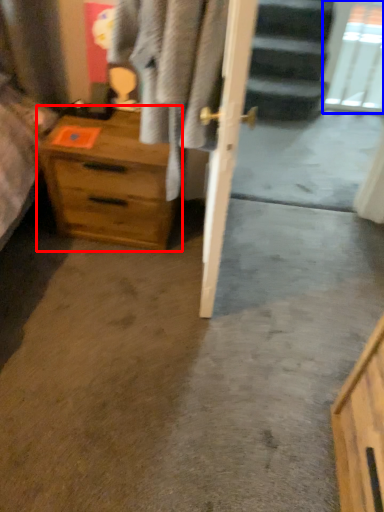
Question: Which of the following is the closest to the observer, chest of drawers (highlighted by a red box) or glass door (highlighted by a blue box)?

Choices:
 (A) chest of drawers
 (B) glass door

Answer: (A)